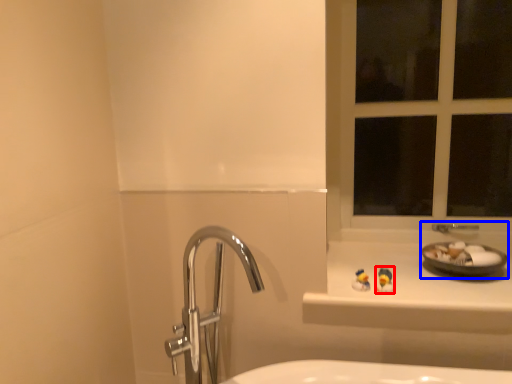
Question: Among these objects, which one is nearest to the camera, miniature (highlighted by a red box) or sink (highlighted by a blue box)?

Choices:
 (A) miniature
 (B) sink

Answer: (A)